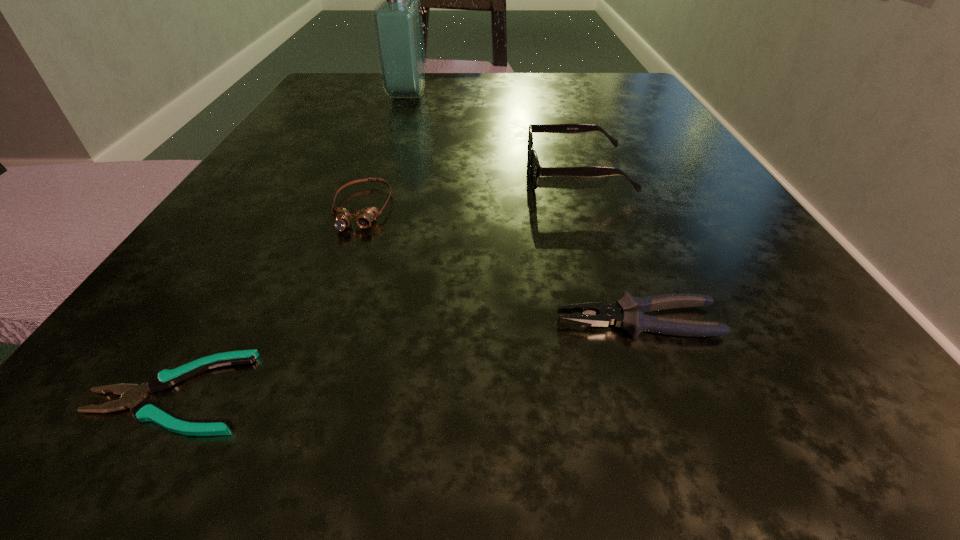
Locate an element on the screen. free space between the goggles and the tallest object is located at coordinates (384, 152).

What are the coordinates of `free space between the sunglasses and the fourth farthest object` in the screenshot? It's located at (608, 247).

What are the coordinates of `the second closest object to the goggles` in the screenshot? It's located at (536, 170).

Locate which object ranks in proximity to the goggles. Please provide its 2D coordinates. Your answer should be formatted as a tuple, i.e. [(x, y)], where the tuple contains the x and y coordinates of a point satisfying the conditions above.

[(144, 410)]